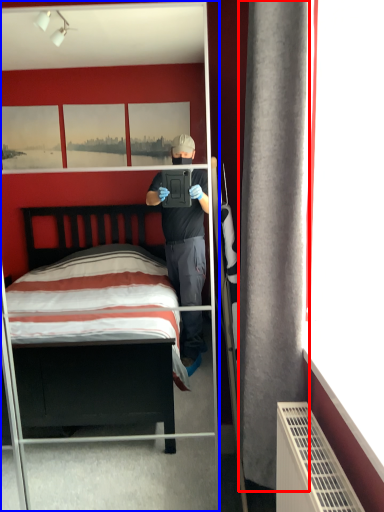
Question: Which object appears closest to the camera in this image, curtain (highlighted by a red box) or mirror (highlighted by a blue box)?

Choices:
 (A) curtain
 (B) mirror

Answer: (A)